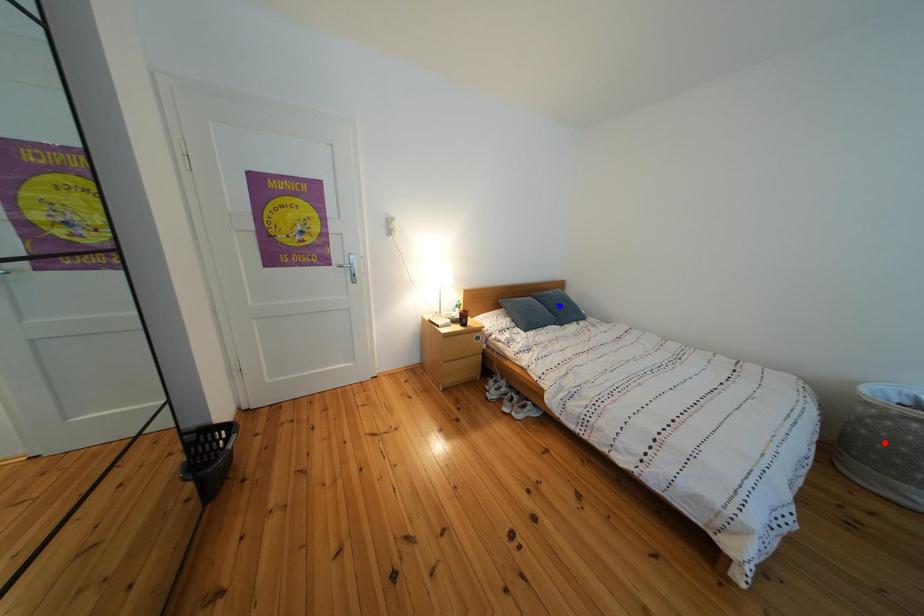
Question: Two points are marked on the image. Which point is closer to the camera?

Choices:
 (A) Blue point is closer.
 (B) Red point is closer.

Answer: (B)